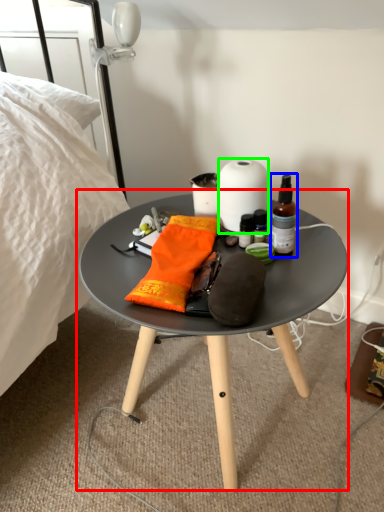
Question: Which object is positioned farthest from coffee table (highlighted by a red box)? Select from bottle (highlighted by a blue box) and paper towel (highlighted by a green box).

Choices:
 (A) bottle
 (B) paper towel

Answer: (B)